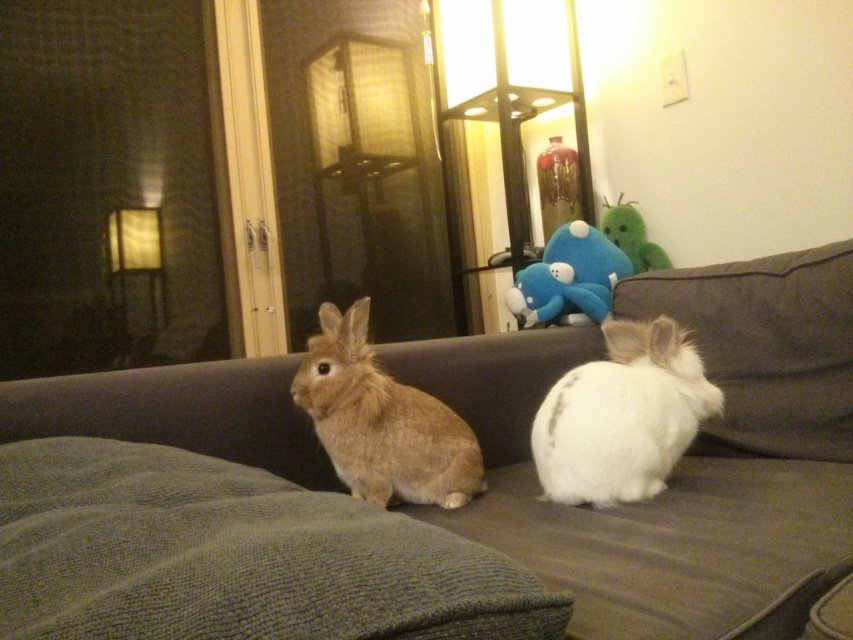
Can you confirm if brown fluffy rabbit at center is wider than blue plush toy at center?

No, brown fluffy rabbit at center is not wider than blue plush toy at center.

Between brown fluffy rabbit at center and blue plush toy at center, which one appears on the right side from the viewer's perspective?

blue plush toy at center is more to the right.

Which is in front, point (306, 378) or point (605, 252)?

Point (306, 378)

Where is `brown fluffy rabbit at center`? This screenshot has width=853, height=640. brown fluffy rabbit at center is located at coordinates (381, 420).

Is point (532, 563) in front of point (595, 273)?

Yes, it is in front of point (595, 273).

Based on the photo, is brown fabric couch at center shorter than blue plush toy at center?

No.

Find the location of a particular element. brown fabric couch at center is located at coordinates (683, 458).

The image size is (853, 640). What are the coordinates of `brown fabric couch at center` in the screenshot? It's located at 683,458.

Between point (845, 378) and point (614, 452), which one is positioned behind?

The point (845, 378) is behind.

Describe the element at coordinates (683, 458) in the screenshot. I see `brown fabric couch at center` at that location.

In order to click on brown fabric couch at center in this screenshot , I will do `click(683, 458)`.